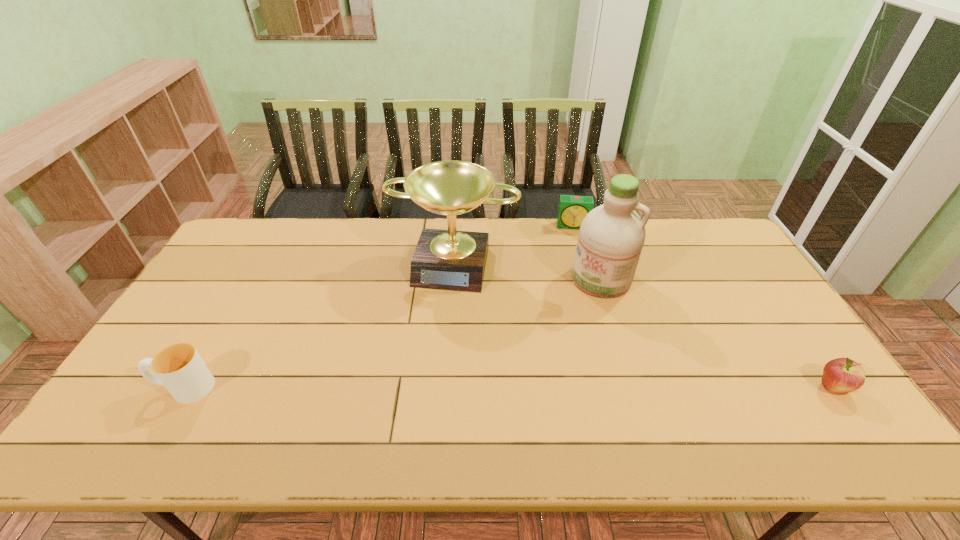
This screenshot has height=540, width=960. Identify the location of blank area located 0.190m on the front-facing side of the fourth object from right to left. (432, 340).

Find the location of `blank area located 0.260m on the front-facing side of the alarm clock`. blank area located 0.260m on the front-facing side of the alarm clock is located at coordinates (577, 278).

This screenshot has width=960, height=540. What are the coordinates of `vacant position located 0.060m on the front-facing side of the alarm clock` in the screenshot? It's located at (573, 241).

The width and height of the screenshot is (960, 540). I want to click on free space located on the front-facing side of the alarm clock, so click(578, 295).

Identify the location of vacant region located 0.330m on the front label of the cleansing agent. This screenshot has height=540, width=960. (540, 370).

At what (x,y) coordinates should I click in order to perform the action: click on free point located on the front label of the cleansing agent. Please return your answer as a coordinate pair (x, y). This screenshot has width=960, height=540. Looking at the image, I should click on (531, 384).

Identify the location of vacant point located on the front label of the cleansing agent. The height and width of the screenshot is (540, 960). [x=578, y=314].

Where is `award that is at the far edge`? The image size is (960, 540). award that is at the far edge is located at coordinates (453, 260).

The height and width of the screenshot is (540, 960). I want to click on alarm clock that is at the far edge, so click(x=572, y=210).

Where is `cup located in the near edge section of the desktop`? Image resolution: width=960 pixels, height=540 pixels. cup located in the near edge section of the desktop is located at coordinates (179, 367).